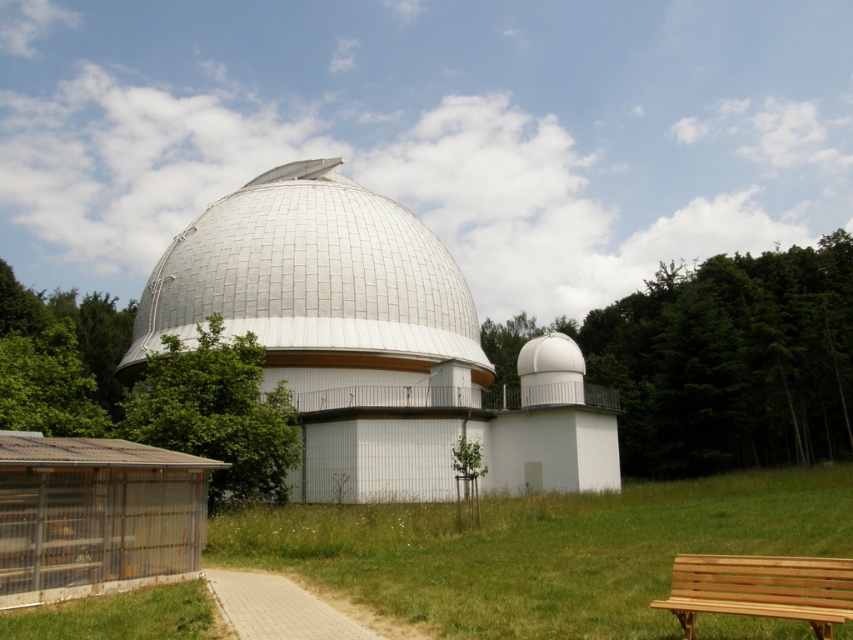
Consider the image. Does green leafy tree at right appear under white textured dome at center?

Yes.

Is point (718, 291) farther from viewer compared to point (415, 305)?

Yes.

Is point (494, 337) less distant than point (369, 314)?

No, (494, 337) is behind (369, 314).

Locate an element on the screen. This screenshot has width=853, height=640. green leafy tree at right is located at coordinates (718, 360).

Between green grass at center and brown wooden bench at lower right, which one is positioned lower?

Positioned lower is green grass at center.

Which is in front, point (741, 504) or point (851, 573)?

Positioned in front is point (851, 573).

Does point (500, 604) come closer to viewer compared to point (817, 621)?

No, it is not.

Where is `green grass at center`? green grass at center is located at coordinates (540, 550).

Is green leafy tree at left thinner than brown wooden bench at lower right?

No.

Is point (218, 333) farther from viewer compared to point (786, 576)?

Yes.

You are a GUI agent. You are given a task and a screenshot of the screen. Output one action in this format:
    pyautogui.click(x=<x>, y=<y>)
    Task: Click on the green leafy tree at left
    
    Given the screenshot: What is the action you would take?
    pyautogui.click(x=218, y=413)